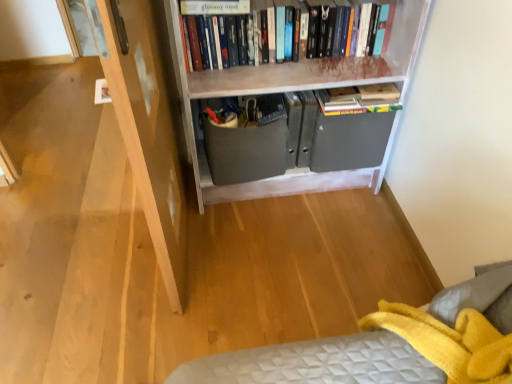
Question: From a real-world perspective, is hardcover book at upper center over hardcover books at upper center?

Choices:
 (A) yes
 (B) no

Answer: (A)

Question: From the image's perspective, is hardcover book at upper center located beneath hardcover books at upper center?

Choices:
 (A) no
 (B) yes

Answer: (A)

Question: Considering the relative sizes of hardcover book at upper center and hardcover books at upper center in the image provided, is hardcover book at upper center taller than hardcover books at upper center?

Choices:
 (A) yes
 (B) no

Answer: (B)

Question: From a real-world perspective, is hardcover book at upper center beneath hardcover books at upper center?

Choices:
 (A) yes
 (B) no

Answer: (B)

Question: Can you confirm if hardcover book at upper center is smaller than hardcover books at upper center?

Choices:
 (A) no
 (B) yes

Answer: (B)

Question: In terms of height, does matte gray drawer at center look taller or shorter compared to white painted wood bookcase at upper center?

Choices:
 (A) short
 (B) tall

Answer: (A)

Question: Which is correct: matte gray drawer at center is inside white painted wood bookcase at upper center, or outside of it?

Choices:
 (A) inside
 (B) outside

Answer: (A)

Question: From the image's perspective, is matte gray drawer at center above or below white painted wood bookcase at upper center?

Choices:
 (A) below
 (B) above

Answer: (A)

Question: Looking at their shapes, would you say matte gray drawer at center is wider or thinner than white painted wood bookcase at upper center?

Choices:
 (A) thin
 (B) wide

Answer: (A)

Question: Visually, is white painted wood bookcase at upper center positioned to the left or to the right of hardcover books at upper center?

Choices:
 (A) left
 (B) right

Answer: (B)

Question: In terms of height, does white painted wood bookcase at upper center look taller or shorter compared to hardcover books at upper center?

Choices:
 (A) tall
 (B) short

Answer: (A)

Question: Is white painted wood bookcase at upper center spatially inside hardcover books at upper center, or outside of it?

Choices:
 (A) inside
 (B) outside

Answer: (B)

Question: Does point (298, 190) appear closer or farther from the camera than point (334, 16)?

Choices:
 (A) closer
 (B) farther

Answer: (B)

Question: From a real-world perspective, is hardcover books at upper center physically located above or below white painted wood bookcase at upper center?

Choices:
 (A) above
 (B) below

Answer: (A)

Question: Is hardcover books at upper center situated inside white painted wood bookcase at upper center or outside?

Choices:
 (A) outside
 (B) inside

Answer: (B)